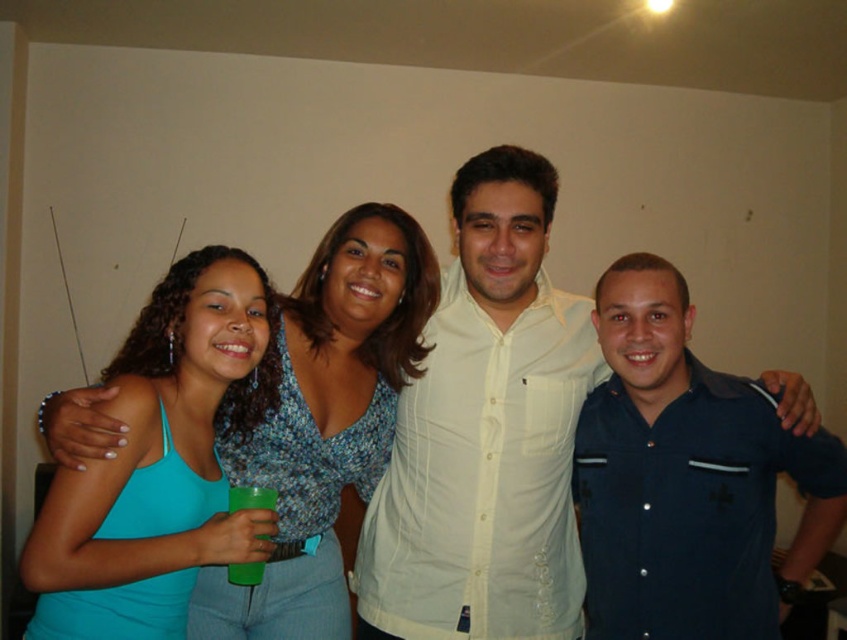
You are organizing a clothing donation drive and need to categorize the dark blue shirt at center and the teal fabric tank top at left based on their sizes. Which one should be placed in the large size bin?

The dark blue shirt at center is larger in size than the teal fabric tank top at left, so it should be placed in the large size bin.